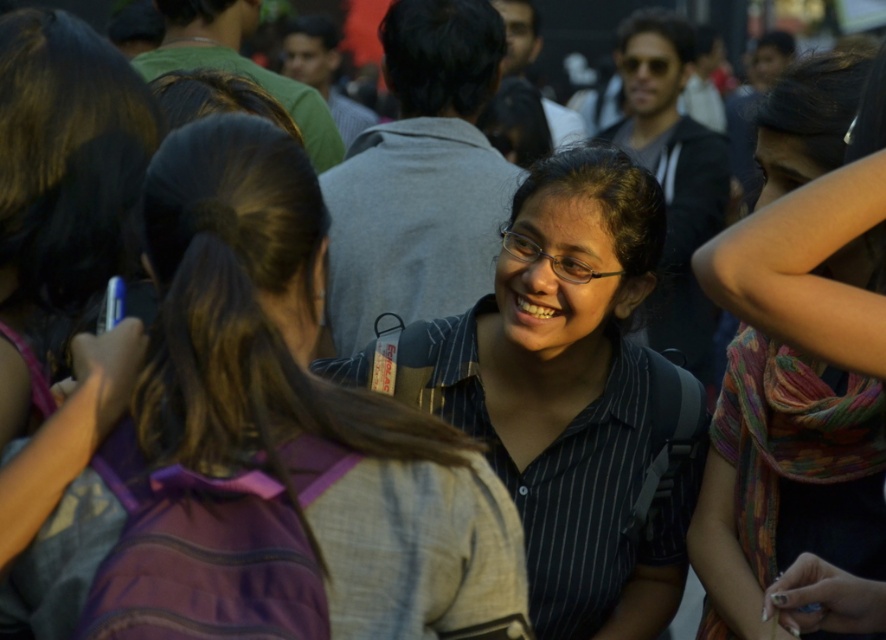
From the picture: You are a photographer trying to capture a clear shot of the black striped shirt at center and the multicolored scarf at center. Which object should you focus on first if you want to ensure both are in focus, considering their sizes?

The black striped shirt at center is larger in size than the multicolored scarf at center, so you should focus on the black striped shirt at center first to ensure both are in focus.

You are a photographer trying to capture a candid shot of the black striped shirt at center and the multicolored scarf at center. Since you want to ensure both are in focus, you need to know which one is taller. Can you tell me which object is taller?

The black striped shirt at center is much taller as the multicolored scarf at center, so the black striped shirt at center is taller.

In the scene shown: You are standing in the crowd and want to move from point A to point B. Point A is at coordinates point (x=278, y=310) and point B is at coordinates point (x=554, y=156). Which point is closer to you?

Point (x=278, y=310) is closer to the viewer than point (x=554, y=156), so point A is closer to you.